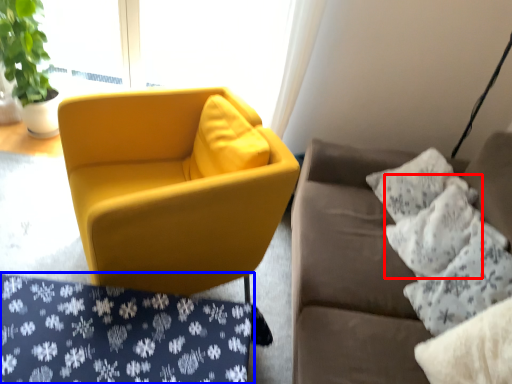
Question: Which of the following is the farthest to the observer, pillow (highlighted by a red box) or pattern (highlighted by a blue box)?

Choices:
 (A) pillow
 (B) pattern

Answer: (A)